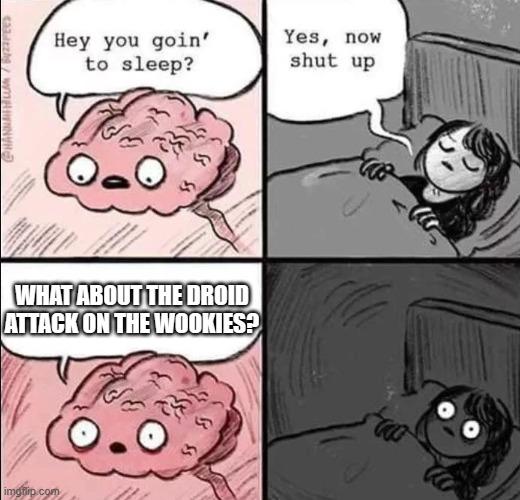
This screenshot has height=500, width=520. In order to click on bed in this screenshot , I will do `click(338, 471)`, `click(370, 224)`.